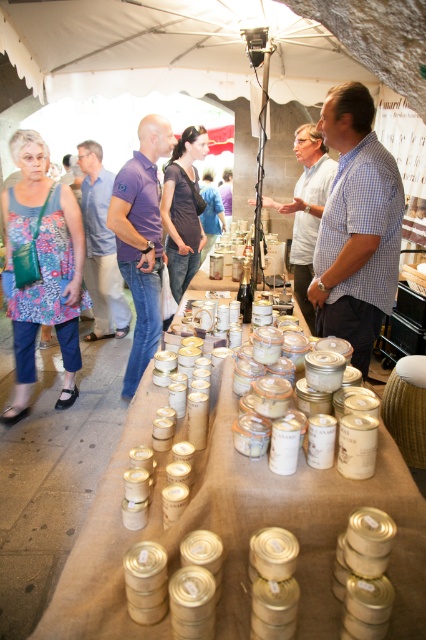
Which of these two, checkered fabric shirt at center or purple cotton shirt at center, stands shorter?

With less height is checkered fabric shirt at center.

Measure the distance between checkered fabric shirt at center and purple cotton shirt at center.

The distance of checkered fabric shirt at center from purple cotton shirt at center is 8.31 feet.

Image resolution: width=426 pixels, height=640 pixels. I want to click on checkered fabric shirt at center, so click(x=356, y=227).

This screenshot has width=426, height=640. I want to click on checkered fabric shirt at center, so click(x=356, y=227).

Which is in front, point (49, 275) or point (91, 240)?

Positioned in front is point (49, 275).

Between floral fabric dress at left and purple cotton shirt at center, which one is positioned lower?

floral fabric dress at left is lower down.

Locate an element on the screen. The height and width of the screenshot is (640, 426). floral fabric dress at left is located at coordinates (43, 268).

Can you confirm if checkered fabric shirt at center is positioned to the left of dark brown leather jacket at center?

No, checkered fabric shirt at center is not to the left of dark brown leather jacket at center.

Does checkered fabric shirt at center appear under dark brown leather jacket at center?

Indeed, checkered fabric shirt at center is positioned under dark brown leather jacket at center.

Does point (339, 285) lie behind point (166, 186)?

No.

At what (x,y) coordinates should I click in order to perform the action: click on checkered fabric shirt at center. Please return your answer as a coordinate pair (x, y). This screenshot has width=426, height=640. Looking at the image, I should click on (356, 227).